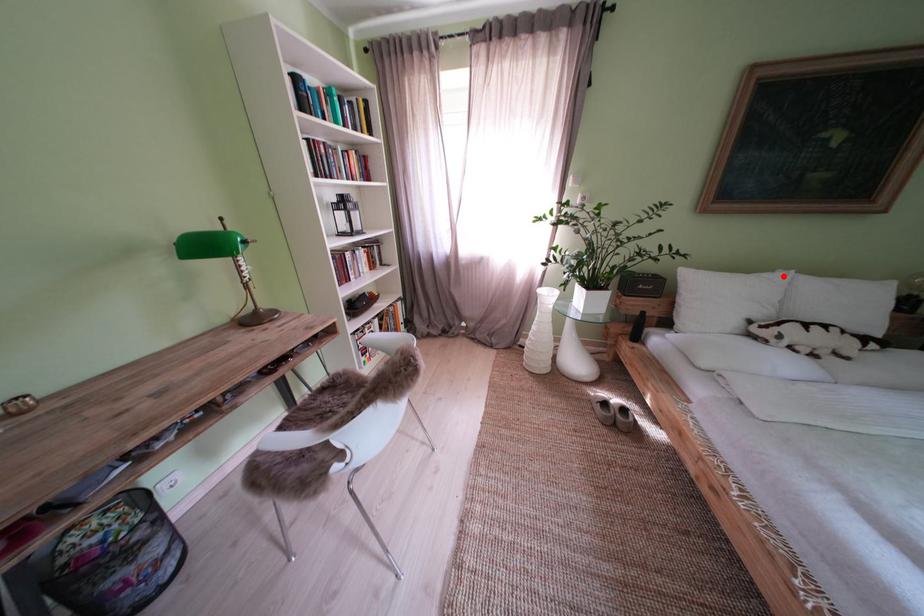
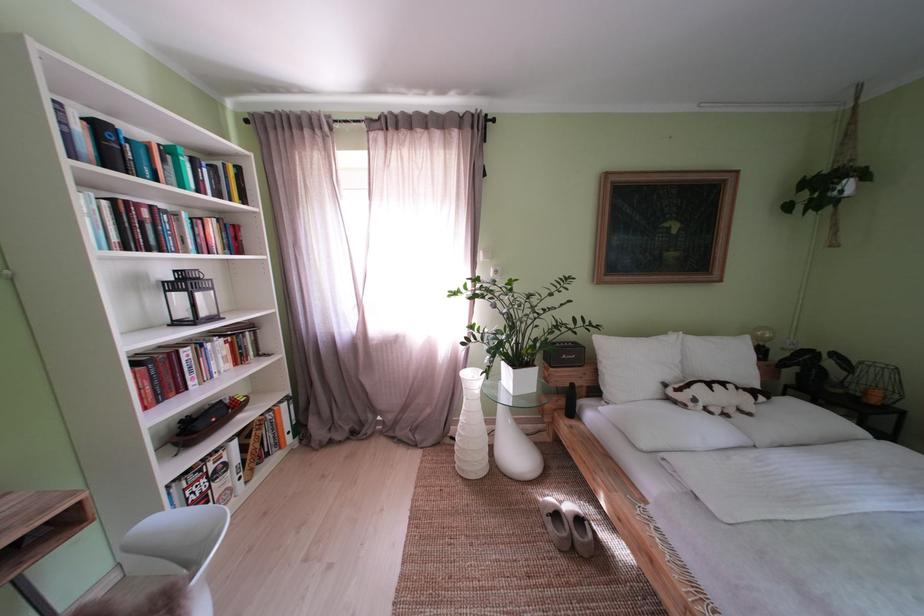
Find the pixel in the second image that matches the highlighted location in the first image.

(675, 338)